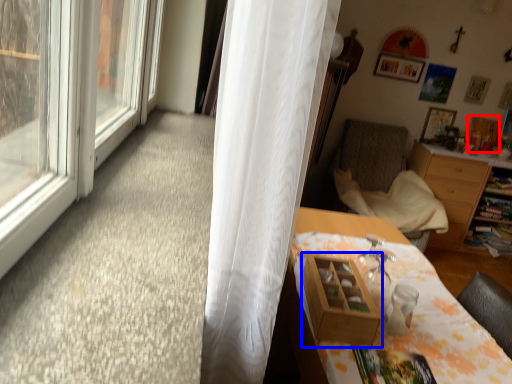
Question: Which object appears closest to the camera in this image, picture frame (highlighted by a red box) or shelf (highlighted by a blue box)?

Choices:
 (A) picture frame
 (B) shelf

Answer: (B)